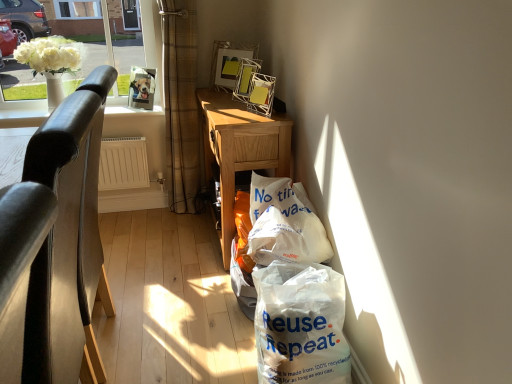
At what (x,y) coordinates should I click in order to perform the action: click on vacant area that lies between black leather chair at left and wooden desk at center. Please return your answer as a coordinate pair (x, y). This screenshot has width=512, height=384. Looking at the image, I should click on (172, 278).